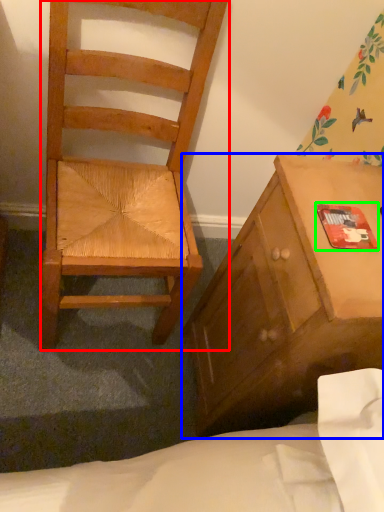
Question: Considering the real-world distances, which object is farthest from chair (highlighted by a red box)? cabinetry (highlighted by a blue box) or paperback book (highlighted by a green box)?

Choices:
 (A) cabinetry
 (B) paperback book

Answer: (B)